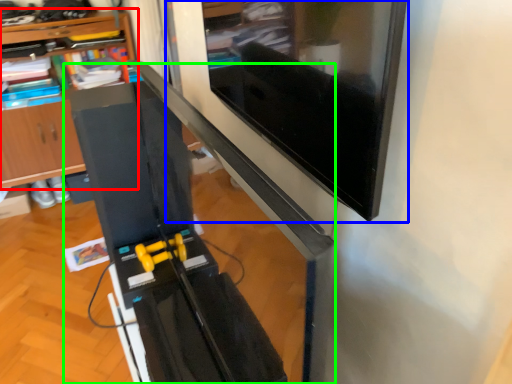
Question: Considering the real-world distances, which object is closest to shelf (highlighted by a red box)? computer monitor (highlighted by a blue box) or computer desk (highlighted by a green box).

Choices:
 (A) computer monitor
 (B) computer desk

Answer: (B)